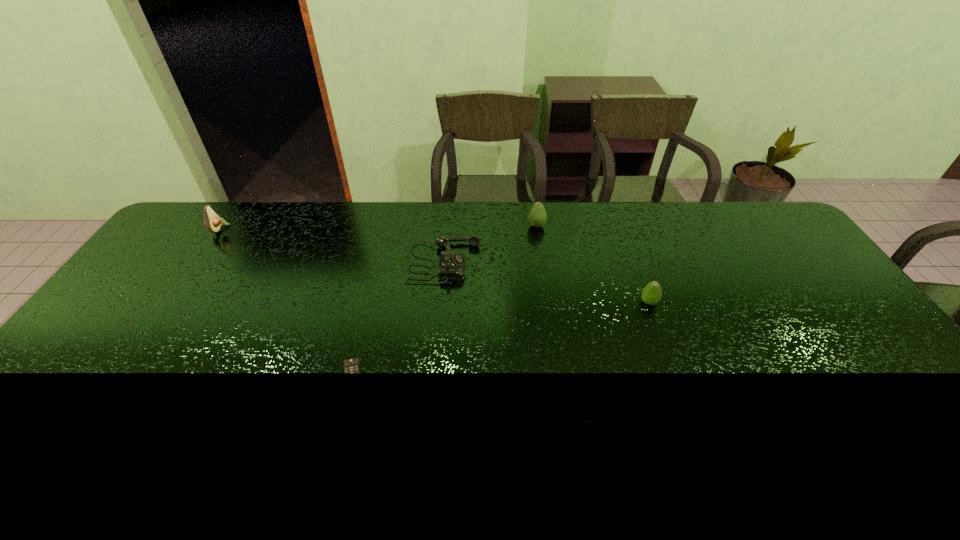
Find the location of a particular element. vacant space located on the front of the second avocado from right to left is located at coordinates (541, 260).

Locate an element on the screen. The height and width of the screenshot is (540, 960). vacant space located 0.130m on the dial of the third farthest object is located at coordinates (520, 262).

You are a GUI agent. You are given a task and a screenshot of the screen. Output one action in this format:
    pyautogui.click(x=<x>, y=<y>)
    Task: Click on the free point located on the right of the rightmost object
    
    Given the screenshot: What is the action you would take?
    pyautogui.click(x=759, y=302)

Where is `free space located on the right of the fourth object from right to left`? The height and width of the screenshot is (540, 960). free space located on the right of the fourth object from right to left is located at coordinates (404, 386).

Find the location of `telephone present at the far edge`. telephone present at the far edge is located at coordinates (451, 265).

This screenshot has width=960, height=540. I want to click on object positioned at the left edge, so click(212, 222).

At what (x,y) coordinates should I click in order to perform the action: click on object that is at the far left corner. Please return your answer as a coordinate pair (x, y). Looking at the image, I should click on (212, 222).

In the image, there is a desktop. Identify the location of vacant space at the far edge. (454, 208).

Where is `blank space at the near edge of the desktop`? This screenshot has height=540, width=960. blank space at the near edge of the desktop is located at coordinates (100, 446).

At what (x,y) coordinates should I click in order to perform the action: click on vacant space at the left edge of the desktop. Please return your answer as a coordinate pair (x, y). This screenshot has height=540, width=960. Looking at the image, I should click on (170, 250).